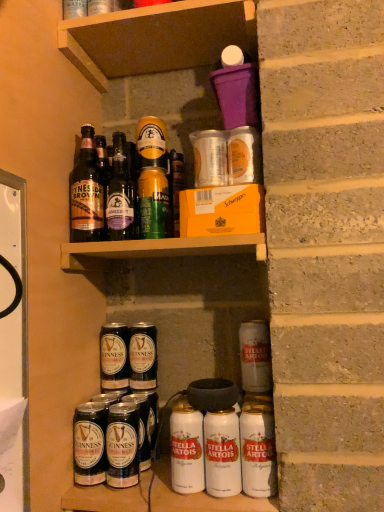
Question: Could you tell me if brown glass bottles at upper left, the second bottle in the right-to-left sequence, is turned towards dark brown glass bottle at lower left, which is the first beer from left to right?

Choices:
 (A) yes
 (B) no

Answer: (B)

Question: Considering the relative sizes of brown glass bottles at upper left, the second bottle in the right-to-left sequence, and dark brown glass bottle at lower left, the 3th beer in the back-to-front sequence, in the image provided, is brown glass bottles at upper left, the second bottle in the right-to-left sequence, wider than dark brown glass bottle at lower left, the 3th beer in the back-to-front sequence,?

Choices:
 (A) yes
 (B) no

Answer: (A)

Question: From the image's perspective, does brown glass bottles at upper left, the second bottle in the right-to-left sequence, appear higher than dark brown glass bottle at lower left, the fourth beer positioned from the right?

Choices:
 (A) yes
 (B) no

Answer: (A)

Question: Is brown glass bottles at upper left, the first bottle positioned from the left, not within dark brown glass bottle at lower left, the 2th beer in the front-to-back sequence?

Choices:
 (A) no
 (B) yes

Answer: (B)

Question: Is the position of brown glass bottles at upper left, the second bottle in the right-to-left sequence, less distant than that of dark brown glass bottle at lower left, which is the first beer from left to right?

Choices:
 (A) no
 (B) yes

Answer: (A)

Question: Considering the relative positions of brown glass bottles at upper left, the second bottle in the right-to-left sequence, and dark brown glass bottle at lower left, which is the first beer from left to right, in the image provided, is brown glass bottles at upper left, the second bottle in the right-to-left sequence, behind dark brown glass bottle at lower left, which is the first beer from left to right,?

Choices:
 (A) no
 (B) yes

Answer: (B)

Question: Are white matte can at lower center, positioned as the second yoghurt in right-to-left order, and dark brown glass bottle at lower center located far from each other?

Choices:
 (A) no
 (B) yes

Answer: (A)

Question: From the image's perspective, does white matte can at lower center, marked as the 2th yoghurt in a left-to-right arrangement, appear lower than dark brown glass bottle at lower center?

Choices:
 (A) no
 (B) yes

Answer: (A)

Question: From the image's perspective, is white matte can at lower center, arranged as the 2th yoghurt when viewed from the back, on top of dark brown glass bottle at lower center?

Choices:
 (A) yes
 (B) no

Answer: (A)

Question: Does white matte can at lower center, the second yoghurt positioned from the front, have a lesser width compared to dark brown glass bottle at lower center?

Choices:
 (A) no
 (B) yes

Answer: (B)

Question: Is white matte can at lower center, positioned as the second yoghurt in right-to-left order, bigger than dark brown glass bottle at lower center?

Choices:
 (A) yes
 (B) no

Answer: (B)

Question: Is white matte can at lower center, the 3th yoghurt positioned from the top, facing towards dark brown glass bottle at lower center?

Choices:
 (A) no
 (B) yes

Answer: (A)

Question: From the image's perspective, does white matte can at lower right, the 1th beer when ordered from front to back, appear higher than green matte can at upper center, the first yoghurt positioned from the back?

Choices:
 (A) no
 (B) yes

Answer: (A)